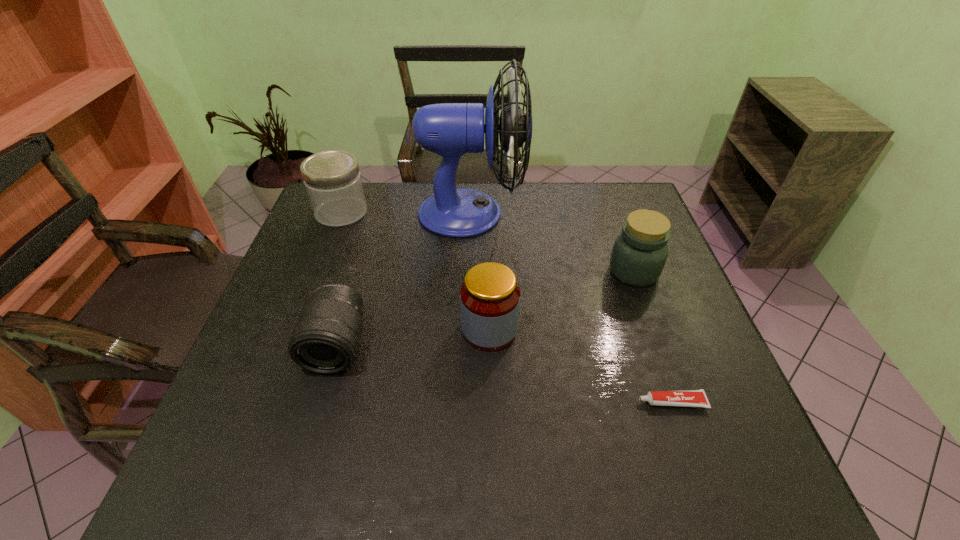
I want to click on the tallest object, so click(x=450, y=130).

Find the location of a particular element. Image resolution: width=960 pixels, height=540 pixels. the farthest jar is located at coordinates (332, 178).

This screenshot has height=540, width=960. Find the location of `the second nearest jar`. the second nearest jar is located at coordinates (639, 253).

This screenshot has width=960, height=540. I want to click on the rightmost jar, so click(x=639, y=253).

Find the location of a particular element. This screenshot has width=960, height=540. the second jar from left to right is located at coordinates (489, 296).

I want to click on the fifth tallest object, so click(x=325, y=340).

This screenshot has width=960, height=540. Find the location of `the nearest object`. the nearest object is located at coordinates (686, 398).

Find the location of a particular element. The image size is (960, 540). the shortest object is located at coordinates (686, 398).

Find the location of a particular element. vacant point located 0.190m in front of the tallest object where the airflow is directed is located at coordinates (585, 213).

Locate an element on the screen. The width and height of the screenshot is (960, 540). vacant space situated on the right of the farthest jar is located at coordinates (449, 212).